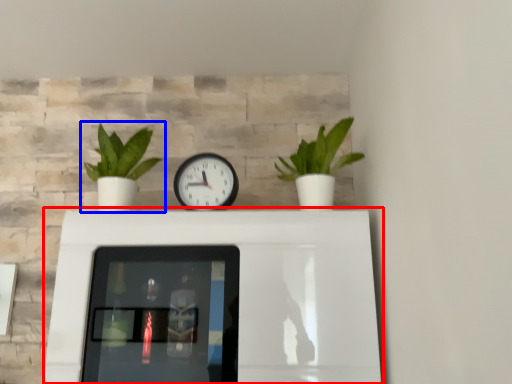
Question: Which point is further to the camera, table (highlighted by a red box) or houseplant (highlighted by a blue box)?

Choices:
 (A) table
 (B) houseplant

Answer: (B)